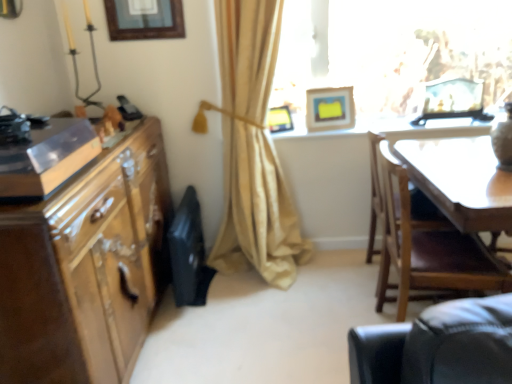
Question: Is white glossy table at upper center bigger than translucent glass frame at upper right?

Choices:
 (A) yes
 (B) no

Answer: (B)

Question: From the image's perspective, is white glossy table at upper center beneath translucent glass frame at upper right?

Choices:
 (A) no
 (B) yes

Answer: (B)

Question: Could you tell me if white glossy table at upper center is turned towards translucent glass frame at upper right?

Choices:
 (A) no
 (B) yes

Answer: (A)

Question: Is white glossy table at upper center smaller than translucent glass frame at upper right?

Choices:
 (A) no
 (B) yes

Answer: (B)

Question: From a real-world perspective, is white glossy table at upper center located higher than translucent glass frame at upper right?

Choices:
 (A) no
 (B) yes

Answer: (A)

Question: Is point (461, 125) closer or farther from the camera than point (351, 104)?

Choices:
 (A) farther
 (B) closer

Answer: (B)

Question: Visually, is white glossy table at upper center positioned to the left or to the right of matte yellow picture frame at upper right, which is the 2th picture frame in right-to-left order?

Choices:
 (A) left
 (B) right

Answer: (B)

Question: From a real-world perspective, is white glossy table at upper center physically located above or below matte yellow picture frame at upper right, which is the 2th picture frame in right-to-left order?

Choices:
 (A) below
 (B) above

Answer: (A)

Question: Do you think white glossy table at upper center is within matte yellow picture frame at upper right, which is the 2th picture frame in right-to-left order, or outside of it?

Choices:
 (A) outside
 (B) inside

Answer: (A)

Question: From the image's perspective, is shiny brown cabinet at left positioned above or below white glossy table at upper center?

Choices:
 (A) below
 (B) above

Answer: (A)

Question: In the image, is shiny brown cabinet at left positioned in front of or behind white glossy table at upper center?

Choices:
 (A) behind
 (B) front

Answer: (B)

Question: Would you say shiny brown cabinet at left is to the left or to the right of white glossy table at upper center in the picture?

Choices:
 (A) left
 (B) right

Answer: (A)

Question: Is shiny brown cabinet at left inside or outside of white glossy table at upper center?

Choices:
 (A) outside
 (B) inside

Answer: (A)

Question: Is wooden picture frame at upper center, acting as the fourth picture frame starting from the right, bigger or smaller than wooden chair at right?

Choices:
 (A) small
 (B) big

Answer: (A)

Question: Looking at their shapes, would you say wooden picture frame at upper center, the first picture frame when ordered from left to right, is wider or thinner than wooden chair at right?

Choices:
 (A) wide
 (B) thin

Answer: (B)